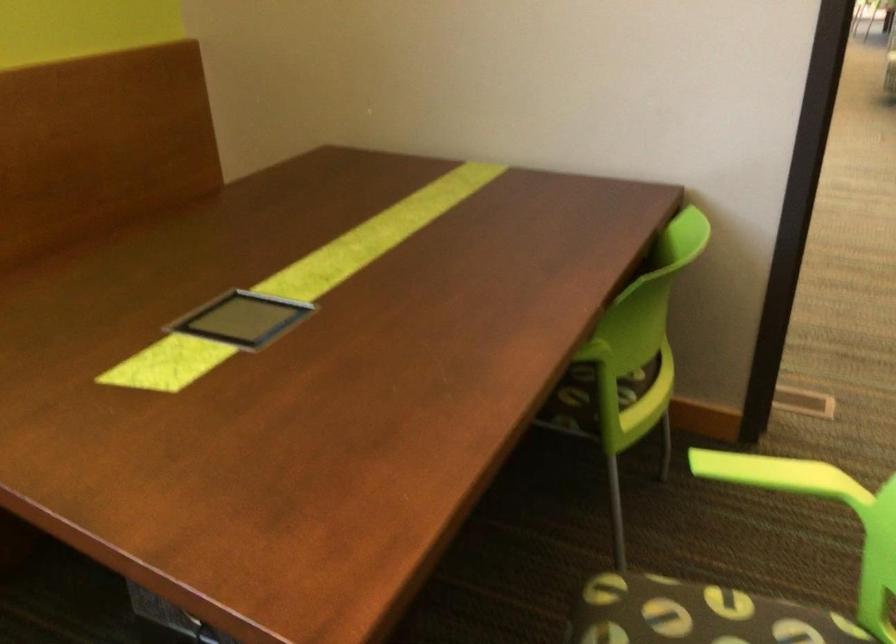
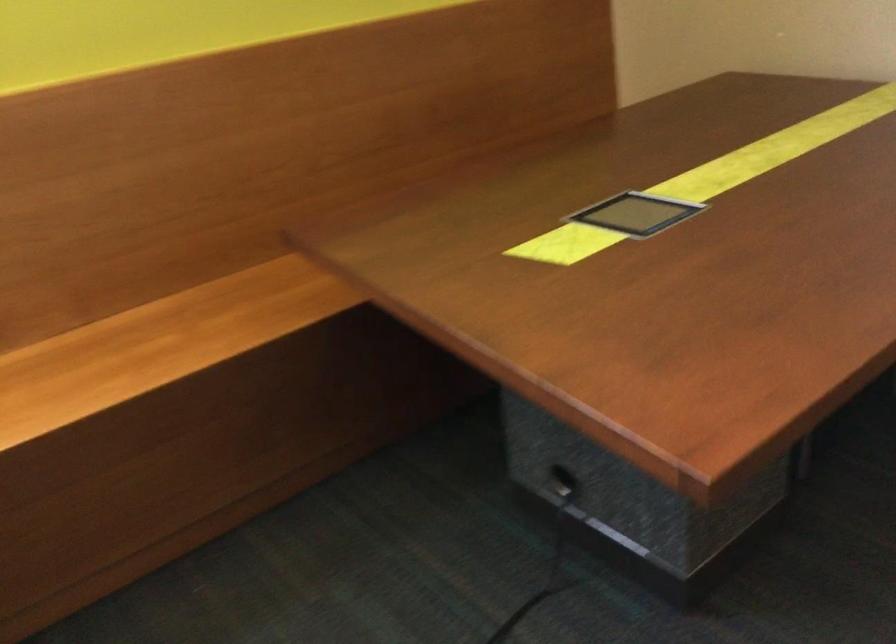
Question: The camera is either moving clockwise (left) or counter-clockwise (right) around the object. The first image is from the beginning of the video and the second image is from the end. Is the camera moving left or right when shooting the video?

Choices:
 (A) Left
 (B) Right

Answer: (B)